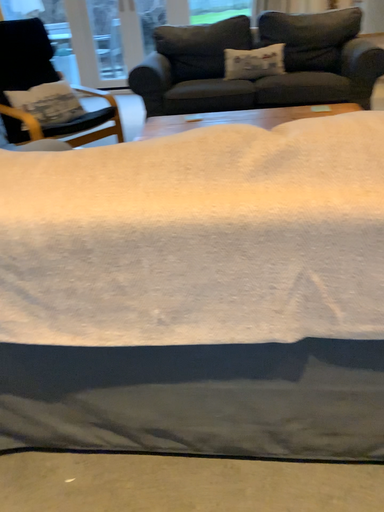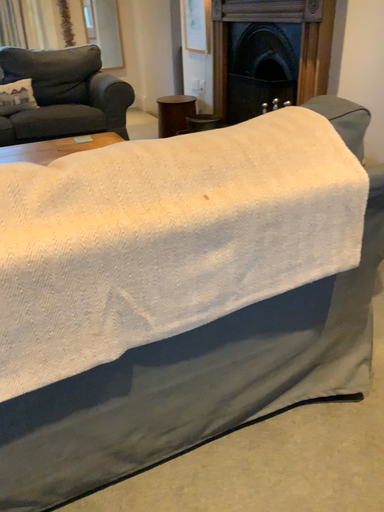
Question: Which way did the camera rotate in the video?

Choices:
 (A) rotated downward
 (B) rotated upward

Answer: (B)